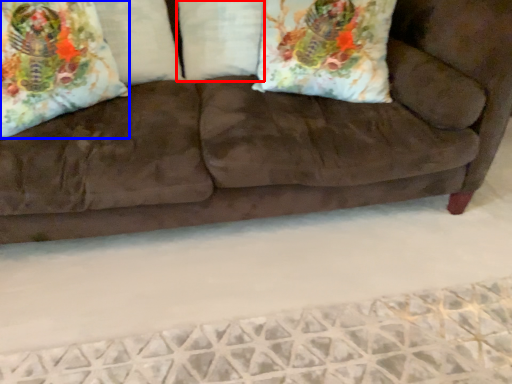
Question: Which object is closer to the camera taking this photo, pillow (highlighted by a red box) or throw pillow (highlighted by a blue box)?

Choices:
 (A) pillow
 (B) throw pillow

Answer: (B)